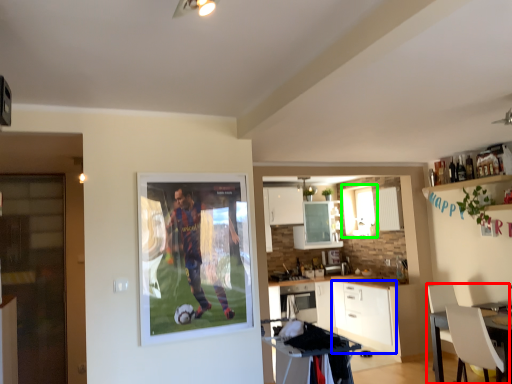
Question: Which is nearer to the chair (highlighted by a red box)? cabinetry (highlighted by a blue box) or window (highlighted by a green box).

Choices:
 (A) cabinetry
 (B) window

Answer: (A)